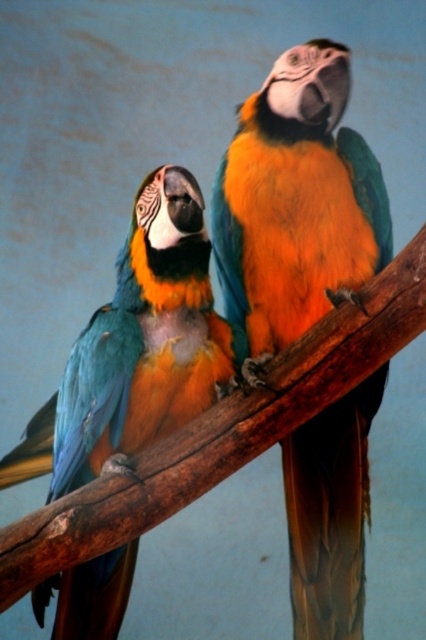
Question: Does shiny orange parrot at center have a larger size compared to shiny blue parrot at left?

Choices:
 (A) no
 (B) yes

Answer: (B)

Question: Which point is closer to the camera?

Choices:
 (A) (314, 509)
 (B) (97, 369)

Answer: (B)

Question: Is shiny orange parrot at center positioned in front of shiny blue parrot at left?

Choices:
 (A) yes
 (B) no

Answer: (B)

Question: Which point is farther from the camera taking this photo?

Choices:
 (A) (379, 403)
 (B) (203, 211)

Answer: (A)

Question: From the image, what is the correct spatial relationship of shiny orange parrot at center in relation to shiny blue parrot at left?

Choices:
 (A) above
 (B) below

Answer: (A)